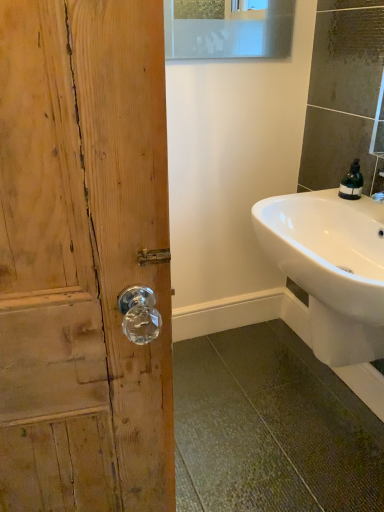
Measure the distance between point (357, 198) and camera.

The depth of point (357, 198) is 4.65 feet.

Identify the location of green matte soap dispenser at upper right. The image size is (384, 512). (352, 182).

What do you see at coordinates (352, 182) in the screenshot? The image size is (384, 512). I see `green matte soap dispenser at upper right` at bounding box center [352, 182].

At what (x,y) coordinates should I click in order to perform the action: click on white glossy sink at lower right. Please return your answer as a coordinate pair (x, y). Looking at the image, I should click on (331, 268).

This screenshot has height=512, width=384. What do you see at coordinates (331, 268) in the screenshot?
I see `white glossy sink at lower right` at bounding box center [331, 268].

At what (x,y) coordinates should I click in order to perform the action: click on green matte soap dispenser at upper right. Please return your answer as a coordinate pair (x, y). The width and height of the screenshot is (384, 512). Looking at the image, I should click on (352, 182).

Does green matte soap dispenser at upper right appear on the right side of white glossy sink at lower right?

Yes.

Does green matte soap dispenser at upper right lie behind white glossy sink at lower right?

That is True.

Which is behind, point (357, 195) or point (330, 225)?

Point (330, 225)

From the image's perspective, who appears lower, green matte soap dispenser at upper right or white glossy sink at lower right?

white glossy sink at lower right appears lower in the image.

From a real-world perspective, relative to white glossy sink at lower right, is green matte soap dispenser at upper right vertically above or below?

From a real-world perspective, green matte soap dispenser at upper right is physically above white glossy sink at lower right.

Considering the relative sizes of green matte soap dispenser at upper right and white glossy sink at lower right in the image provided, is green matte soap dispenser at upper right wider than white glossy sink at lower right?

No, green matte soap dispenser at upper right is not wider than white glossy sink at lower right.

Considering the sizes of green matte soap dispenser at upper right and white glossy sink at lower right in the image, is green matte soap dispenser at upper right taller or shorter than white glossy sink at lower right?

Considering their sizes, green matte soap dispenser at upper right has less height than white glossy sink at lower right.

Consider the image. Considering the sizes of objects green matte soap dispenser at upper right and white glossy sink at lower right in the image provided, who is bigger, green matte soap dispenser at upper right or white glossy sink at lower right?

Bigger between the two is white glossy sink at lower right.

From the picture: Is green matte soap dispenser at upper right situated inside white glossy sink at lower right or outside?

The correct answer is: outside.

Is green matte soap dispenser at upper right directly adjacent to white glossy sink at lower right?

No, green matte soap dispenser at upper right is not touching white glossy sink at lower right.

Looking at this image, is green matte soap dispenser at upper right oriented away from white glossy sink at lower right?

green matte soap dispenser at upper right is not turned away from white glossy sink at lower right.

What's the angular difference between green matte soap dispenser at upper right and white glossy sink at lower right's facing directions?

The angular difference between green matte soap dispenser at upper right and white glossy sink at lower right is 3.4 degrees.

Image resolution: width=384 pixels, height=512 pixels. What are the coordinates of `soap dispenser that is above the white glossy sink at lower right (from a real-world perspective)` in the screenshot? It's located at (352, 182).

Is white glossy sink at lower right to the right of green matte soap dispenser at upper right from the viewer's perspective?

Incorrect, white glossy sink at lower right is not on the right side of green matte soap dispenser at upper right.

Looking at this image, relative to green matte soap dispenser at upper right, is white glossy sink at lower right in front or behind?

Clearly, white glossy sink at lower right is in front of green matte soap dispenser at upper right.

Is point (329, 335) behind point (344, 187)?

No, (329, 335) is in front of (344, 187).

In the scene shown: From the image's perspective, is white glossy sink at lower right located beneath green matte soap dispenser at upper right?

Correct, white glossy sink at lower right appears lower than green matte soap dispenser at upper right in the image.

From a real-world perspective, is white glossy sink at lower right physically located above or below green matte soap dispenser at upper right?

From a real-world perspective, white glossy sink at lower right is physically below green matte soap dispenser at upper right.

Consider the image. Considering the sizes of white glossy sink at lower right and green matte soap dispenser at upper right in the image, is white glossy sink at lower right wider or thinner than green matte soap dispenser at upper right?

Considering their sizes, white glossy sink at lower right looks broader than green matte soap dispenser at upper right.

Can you confirm if white glossy sink at lower right is taller than green matte soap dispenser at upper right?

Yes, white glossy sink at lower right is taller than green matte soap dispenser at upper right.

Who is smaller, white glossy sink at lower right or green matte soap dispenser at upper right?

green matte soap dispenser at upper right is smaller.

Is green matte soap dispenser at upper right inside white glossy sink at lower right?

That's incorrect, green matte soap dispenser at upper right is not inside white glossy sink at lower right.

Is white glossy sink at lower right touching green matte soap dispenser at upper right?

There is a gap between white glossy sink at lower right and green matte soap dispenser at upper right.

Is white glossy sink at lower right oriented away from green matte soap dispenser at upper right?

white glossy sink at lower right is not turned away from green matte soap dispenser at upper right.

Identify the location of sink that appears in front of the green matte soap dispenser at upper right. (331, 268).

Identify the location of sink that appears below the green matte soap dispenser at upper right (from the image's perspective). (331, 268).

In the image, there is a green matte soap dispenser at upper right. In order to click on sink below it (from a real-world perspective) in this screenshot , I will do `click(331, 268)`.